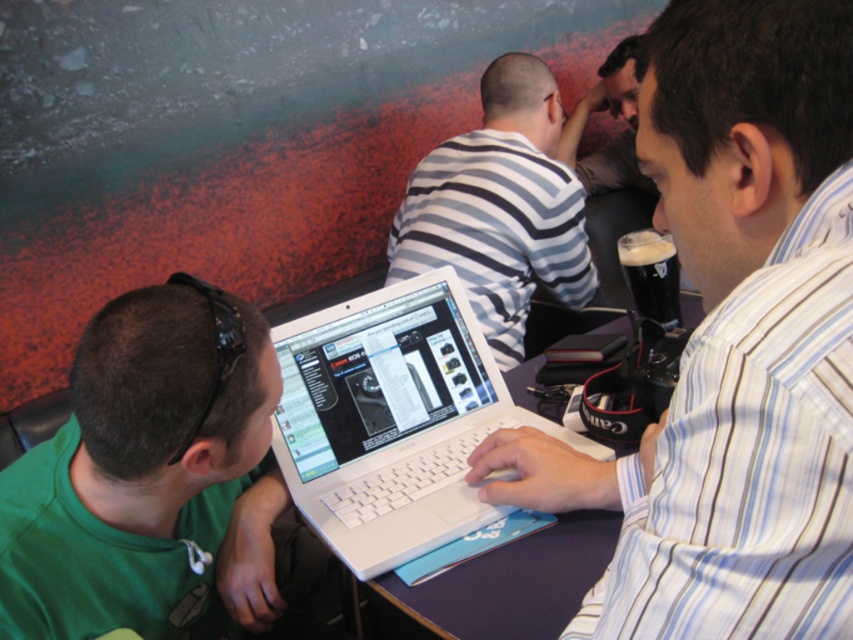
You are trying to decide whether to place a new decorative item on the table. The green matte shirt at lower left and the white plastic laptop at center are already there. Which object would allow more vertical space for the new item if you remove it?

The green matte shirt at lower left has a greater height compared to the white plastic laptop at center, so removing it would free up more vertical space for the new item.

You are trying to determine if the white glossy laptop at center can fit into a storage box that is the same width as the green matte shirt at lower left. Can it fit?

The white glossy laptop at center has a width less than the green matte shirt at lower left, so it can fit into the storage box with the same width as the green matte shirt at lower left.

You are a photographer standing at the camera position. You want to take a closeup photo of the green matte shirt at lower left without moving any objects. Can you do it?

The green matte shirt at lower left is 29.49 inches away from camera, so yes, you can take a closeup photo of the green matte shirt at lower left without moving any objects because it is within a reasonable distance for focusing.